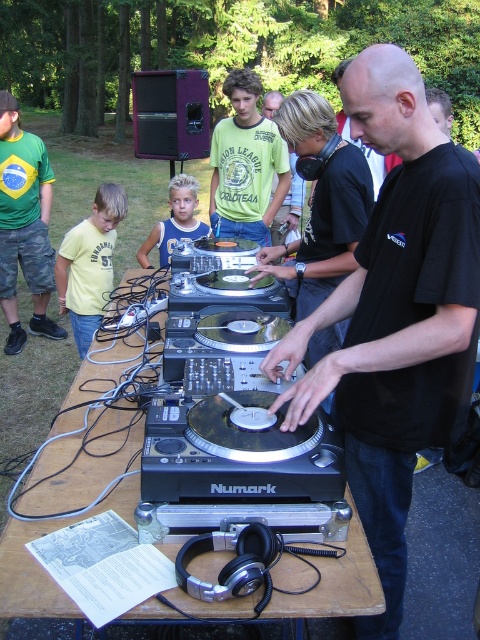
You are a photographer at the event and want to capture both the green jersey at left and the yellow matte shirt at left in a single shot. Which one should you adjust the camera focus to ensure the subject in front is clearer?

You should focus on the green jersey at left because it is in front of the yellow matte shirt at left, so adjusting focus to the green jersey at left will ensure the front subject is clearer.

You are a photographer at the event and want to capture both the green matte shirt at center and the blue jersey at center in the same frame. Which one appears taller in the photo?

The green matte shirt at center appears taller than the blue jersey at center in the photo.